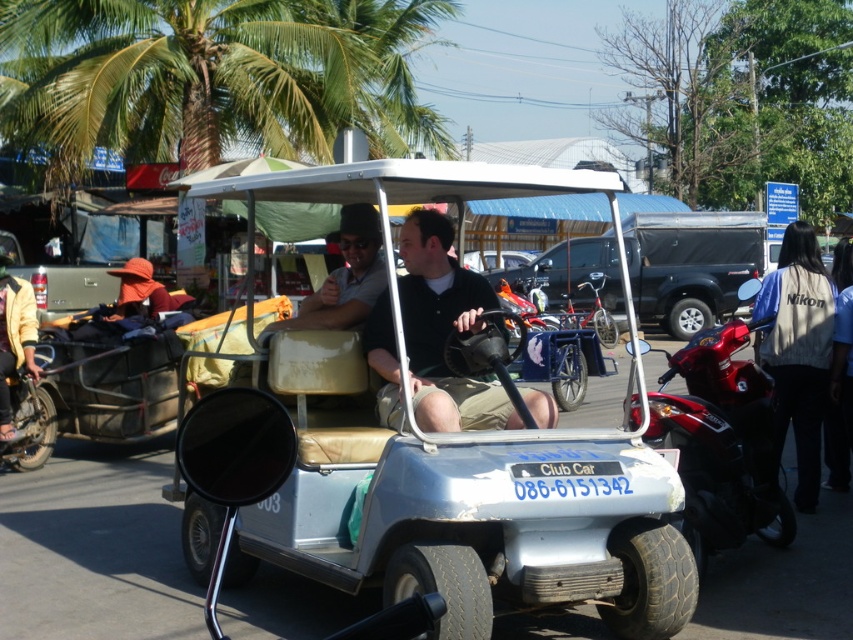
You are a delivery person needing to load a package onto the black matte truck at center. The package is as tall as the khaki fabric jacket at right. Will the package fit vertically inside the truck bed?

The black matte truck at center has a greater height compared to the khaki fabric jacket at right. Since the package is as tall as the khaki fabric jacket at right, it will fit vertically inside the truck bed because the truck is taller than the jacket.

You are standing on the street and see the matte black shirt at center and the brushed metal motorcycle at left. Which object is nearer to you?

The matte black shirt at center is closer to the viewer than the brushed metal motorcycle at left.

You are a delivery person standing in the street scene. You need to place a package on the matte black shirt at center and the brushed metal motorcycle at left. Which object should you place the package on if you want it to be higher?

The matte black shirt at center is above the brushed metal motorcycle at left, so place the package on the matte black shirt at center to have it higher.